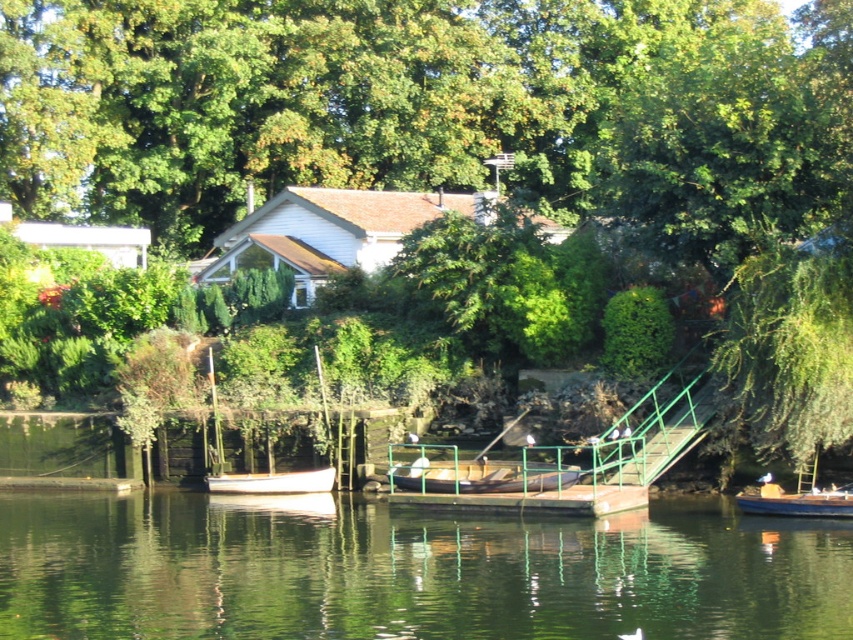
Is wooden boat at center taller than white matte boat at lower left?

No.

Between wooden boat at center and white matte boat at lower left, which one appears on the left side from the viewer's perspective?

white matte boat at lower left

I want to click on wooden boat at center, so click(x=486, y=477).

Between point (831, 490) and point (311, 484), which one is positioned in front?

Point (831, 490) is more forward.

Locate an element on the screen. wooden boat at lower right is located at coordinates tap(796, 500).

Is green reflective water at center to the right of green metallic staircase at center from the viewer's perspective?

No, green reflective water at center is not to the right of green metallic staircase at center.

The image size is (853, 640). Find the location of `green reflective water at center`. green reflective water at center is located at coordinates (410, 570).